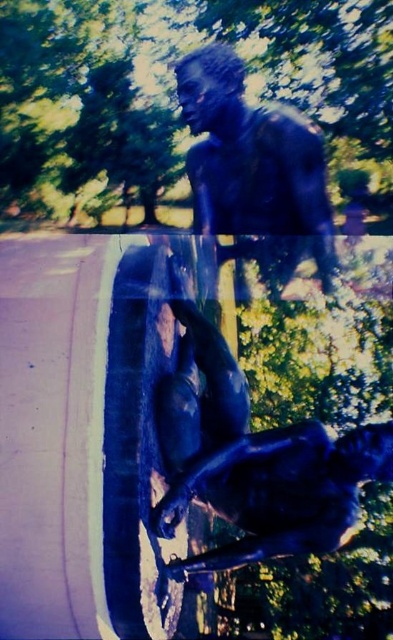
You are an art curator planning to install a new sculpture in a gallery. The sculpture requires a minimum of 1.5 meters of space between the two figures to ensure visitors can walk around comfortably. Based on the image, will the current spacing between the shiny bronze statue at center meet this requirement?

The two figures in the shiny bronze statue at center are 1.40 meters apart, which is less than the required 1.5 meters. Therefore, the current spacing does not meet the requirement for visitor comfort.

You are an art curator planning to display both the shiny bronze statue at center and the bronze statue at upper center in a gallery. Given their sizes, which statue should be placed in a more prominent location to emphasize its dominance in the exhibition?

The shiny bronze statue at center should be placed in a more prominent location because it has a larger size compared to the bronze statue at upper center, making it visually dominant in the exhibition.

You are an art curator planning to photograph the sculpture. You want to ensure that the shiny bronze statue at center and the bronze statue at upper center are both clearly visible in the photo. Based on their positions, which statue will appear closer to the camera in the final image?

The shiny bronze statue at center will appear closer to the camera because it is positioned in front of the bronze statue at upper center.